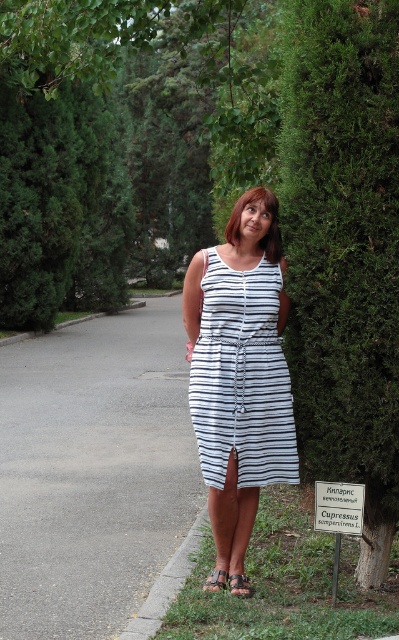
You are a delivery person carrying a large package that requires a clear path of at least 3 meters to maneuver safely. You see the gray asphalt pavement at center and the gray concrete curb at lower left. Can you safely navigate between them with your package?

The gray asphalt pavement at center and the gray concrete curb at lower left are 3.23 meters apart from each other, which is sufficient for the delivery person to maneuver safely with a package requiring at least 3 meters of clearance.

You are a gardener who needs to walk along the gray asphalt pavement at center while avoiding stepping on the black leather sandal at lower center. Can you walk comfortably on the pavement without stepping on the sandal?

The gray asphalt pavement at center is wider than the black leather sandal at lower center, so yes, you can walk comfortably on the gray asphalt pavement at center without stepping on the black leather sandal at lower center.